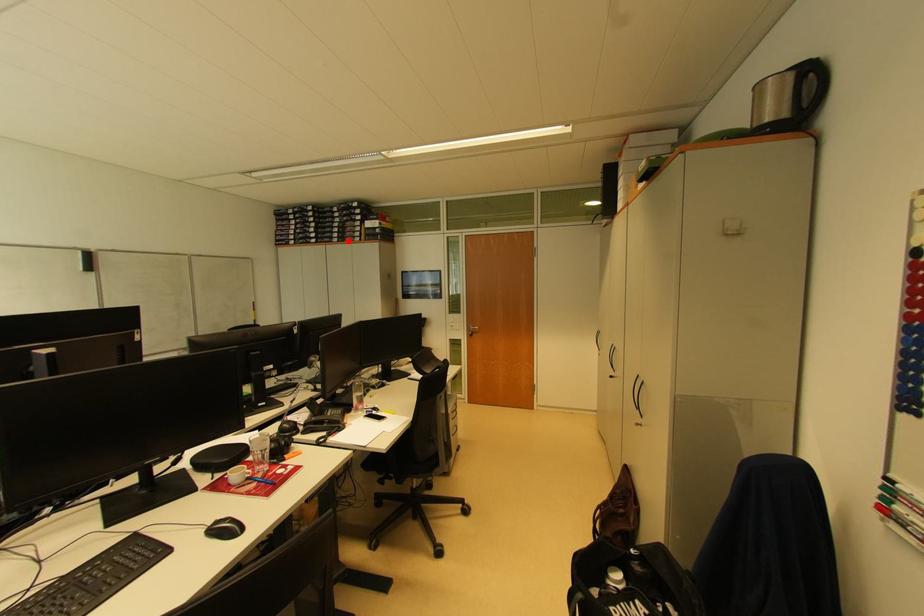
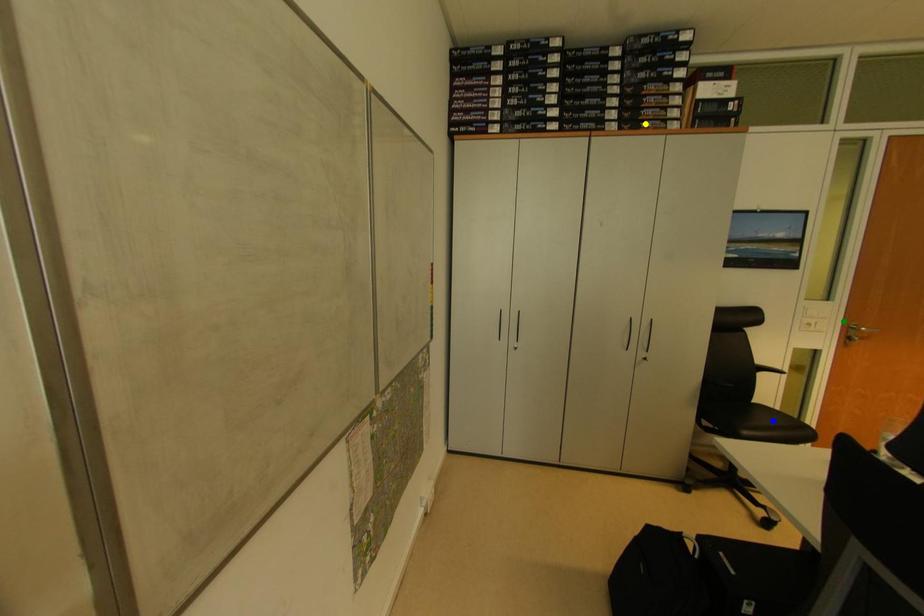
Question: I am providing you with two images of the same scene from different viewpoints. A red point is marked on the first image. You are given multiple points on the second image. Can you choose the point in image 2 that corresponds to the point in image 1?

Choices:
 (A) green point
 (B) yellow point
 (C) blue point

Answer: (B)